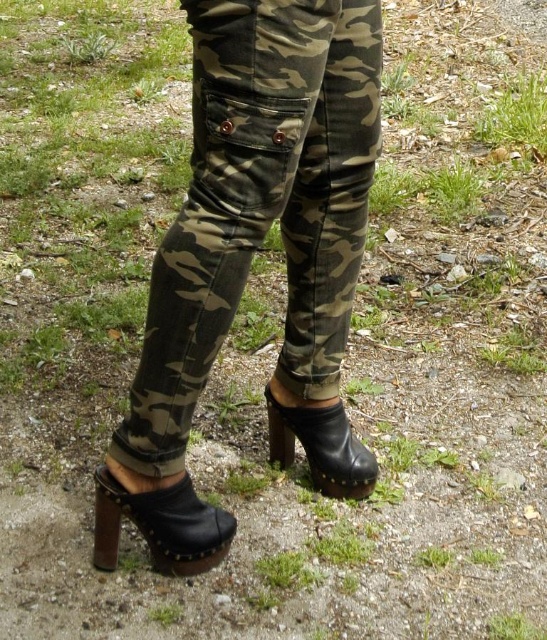
Who is more forward, (110, 509) or (341, 465)?

Point (110, 509) is more forward.

Based on the photo, which is below, black leather sandal at lower left or black leather boot at lower center?

Positioned lower is black leather sandal at lower left.

What do you see at coordinates (160, 525) in the screenshot?
I see `black leather sandal at lower left` at bounding box center [160, 525].

Find the location of a particular element. Image resolution: width=547 pixels, height=640 pixels. black leather sandal at lower left is located at coordinates (160, 525).

Is camo fabric pants at center positioned behind black leather boot at lower center?

No, camo fabric pants at center is in front of black leather boot at lower center.

Can you confirm if camo fabric pants at center is bigger than black leather boot at lower center?

Yes.

Who is more distant from viewer, (x=222, y=291) or (x=354, y=454)?

Positioned behind is point (x=354, y=454).

Identify the location of camo fabric pants at center. (260, 205).

Can you confirm if camo fabric pants at center is taller than black leather sandal at lower left?

Yes, camo fabric pants at center is taller than black leather sandal at lower left.

Who is shorter, camo fabric pants at center or black leather sandal at lower left?

black leather sandal at lower left is shorter.

Is point (307, 33) in front of point (185, 570)?

Yes, point (307, 33) is in front of point (185, 570).

Where is `camo fabric pants at center`? camo fabric pants at center is located at coordinates (260, 205).